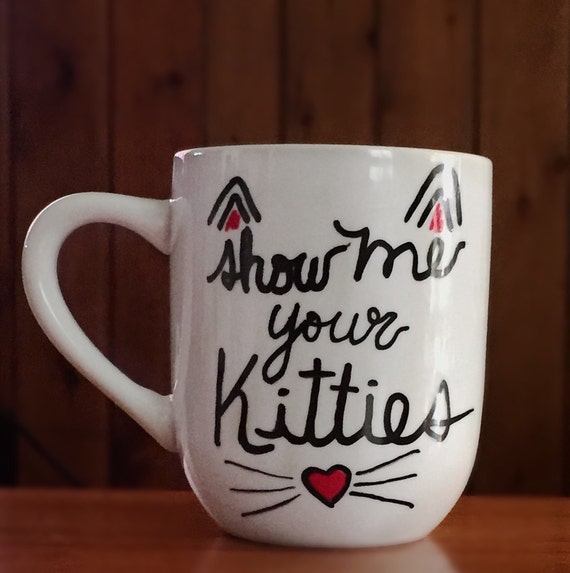
Where is `white mug`? Image resolution: width=570 pixels, height=573 pixels. white mug is located at coordinates (428, 357).